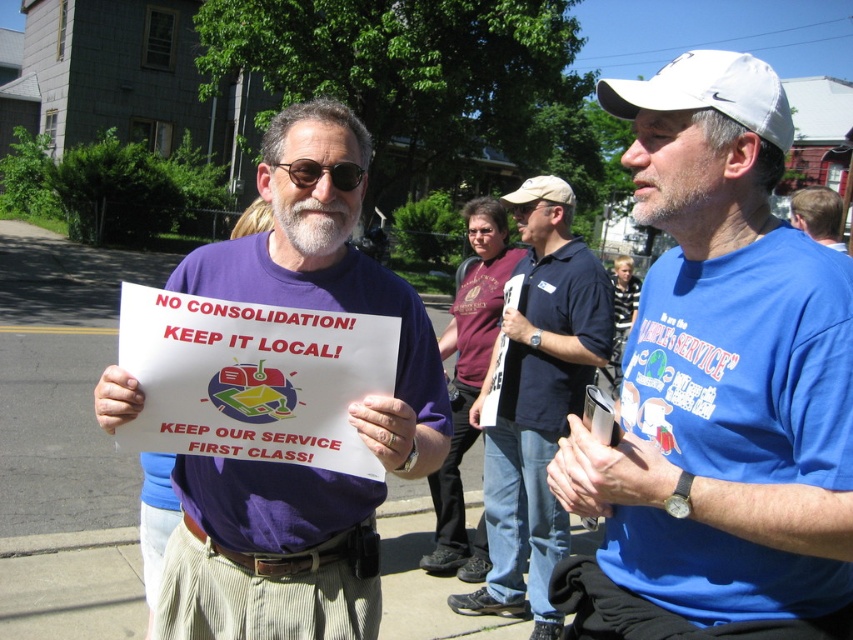
You are a photographer trying to capture a closeup of the blue tshirt at right. The camera you are using has a field of view that can only capture objects within a 0.25 unit radius. Given that the blue tshirt at right is located at point (817,214), will your camera be able to capture it within the specified radius?

The blue tshirt at right is located at point (817,214). The camera has a field of view radius of 0.25 units. To determine if it can capture the blue tshirt at right, calculate the distance from the camera to the point. The distance would be sqrt squared differences in x and y coordinates. However, the question doesn not provide the camera position. Without knowing where the camera is positioned, it is impossible to determine if the blue tshirt at right falls within the 0.25 unit radius. More information,